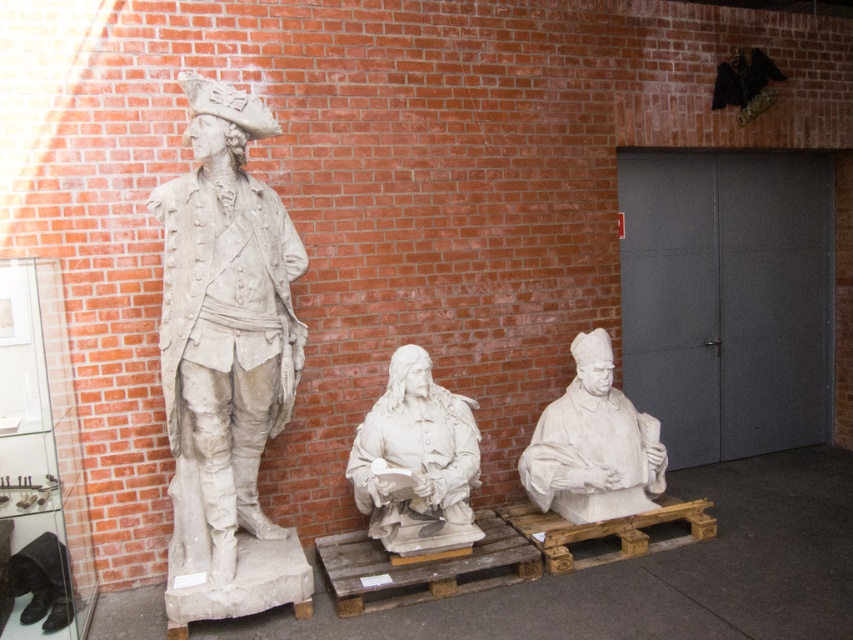
You are a tour guide leading visitors through the museum. You need to point out the white stone statue at left and the white stone bust at center. Which one is located to the right of the other?

The white stone statue at left is positioned on the left side of the white stone bust at center, so the white stone bust at center is to the right of the white stone statue at left.

You are an art student observing the sculptures in the museum. You notice the white stone statue at left and the white stone bust at center. Which one is taller?

The white stone statue at left is taller than the white stone bust at center.

In the scene shown: You are a visitor standing in the museum. You want to take a photo of the white stone bust at center without getting too close. What is the minimum distance you need to maintain to ensure you can capture the entire bust in your camera frame?

The minimum distance you need to maintain is 3.31 meters to ensure the entire white stone bust at center can be captured in your camera frame.